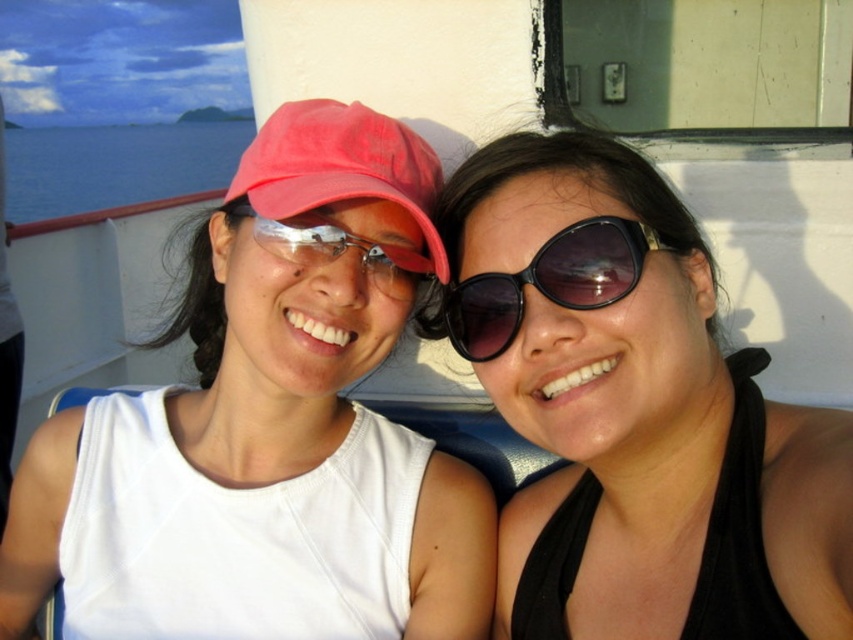
Who is higher up, black matte sunglasses at center or matte white tank top at center?

black matte sunglasses at center

This screenshot has width=853, height=640. Identify the location of black matte sunglasses at center. (634, 412).

This screenshot has height=640, width=853. Find the location of `black matte sunglasses at center`. black matte sunglasses at center is located at coordinates (634, 412).

Is the position of matte red cap at center more distant than that of matte plastic goggles at center?

No.

Is matte red cap at center below matte plastic goggles at center?

No.

Is point (355, 173) positioned behind point (373, 276)?

No, (355, 173) is closer to viewer.

Image resolution: width=853 pixels, height=640 pixels. I want to click on matte red cap at center, so click(x=341, y=170).

I want to click on black matte sunglasses at center, so click(634, 412).

Is black matte sunglasses at center further to the viewer compared to black plastic sunglasses at center?

That is False.

Is point (679, 561) closer to viewer compared to point (485, 344)?

Yes.

Find the location of a particular element. The image size is (853, 640). black matte sunglasses at center is located at coordinates (634, 412).